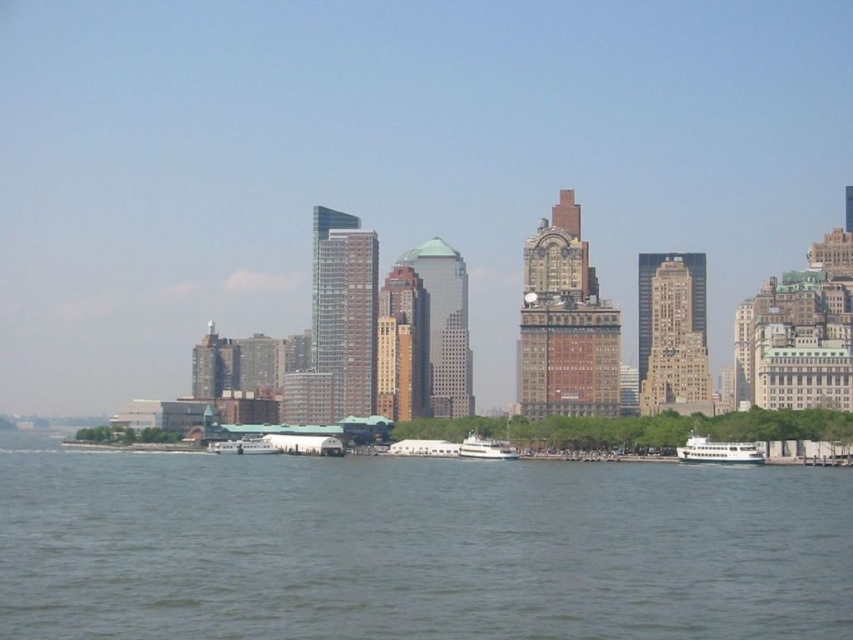
Which is behind, point (688, 449) or point (474, 448)?

Point (688, 449)

Does white glossy ferry at lower right appear over white glossy ferry at center?

Actually, white glossy ferry at lower right is below white glossy ferry at center.

Find the location of a particular element. white glossy ferry at lower right is located at coordinates (718, 451).

Is green water at lower center below white glossy ferry at center?

Yes, green water at lower center is below white glossy ferry at center.

Who is more distant from viewer, (556, 596) or (474, 451)?

Point (556, 596)

You are a GUI agent. You are given a task and a screenshot of the screen. Output one action in this format:
    pyautogui.click(x=<x>, y=<y>)
    Task: Click on the green water at lower center
    This screenshot has width=853, height=640.
    Given the screenshot: What is the action you would take?
    pyautogui.click(x=416, y=547)

Image resolution: width=853 pixels, height=640 pixels. Describe the element at coordinates (416, 547) in the screenshot. I see `green water at lower center` at that location.

Which is above, green water at lower center or white glossy ferry at lower right?

Positioned higher is white glossy ferry at lower right.

This screenshot has width=853, height=640. Describe the element at coordinates (416, 547) in the screenshot. I see `green water at lower center` at that location.

You are a GUI agent. You are given a task and a screenshot of the screen. Output one action in this format:
    pyautogui.click(x=<x>, y=<y>)
    Task: Click on the green water at lower center
    The width and height of the screenshot is (853, 640).
    Given the screenshot: What is the action you would take?
    pyautogui.click(x=416, y=547)